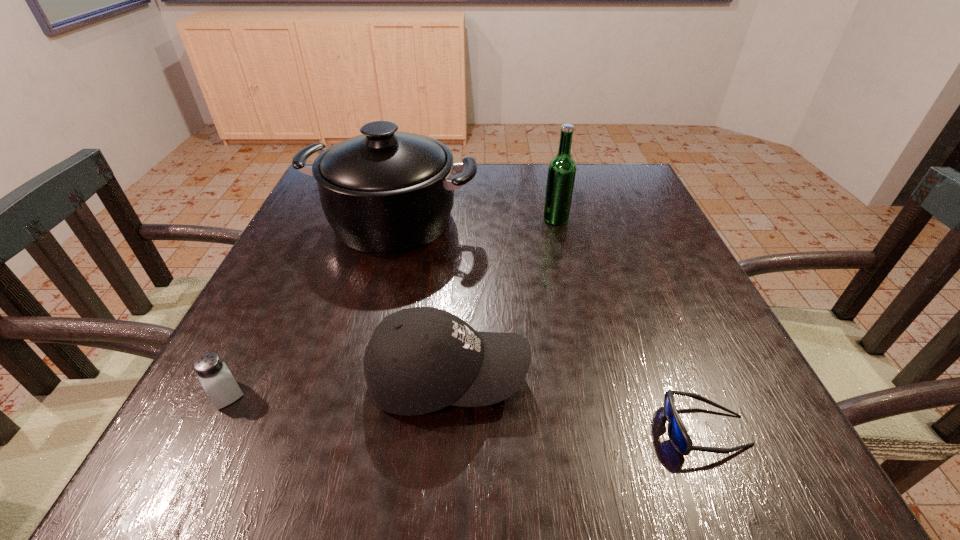
This screenshot has width=960, height=540. Find the location of `vacant space situated on the front-facing side of the sunglasses`. vacant space situated on the front-facing side of the sunglasses is located at coordinates (546, 430).

The image size is (960, 540). Find the location of `free point located on the front-facing side of the sunglasses`. free point located on the front-facing side of the sunglasses is located at coordinates (423, 430).

Where is `vacant position located on the front-facing side of the sunglasses`? vacant position located on the front-facing side of the sunglasses is located at coordinates (573, 430).

You are a GUI agent. You are given a task and a screenshot of the screen. Output one action in this format:
    pyautogui.click(x=<x>, y=<y>)
    Task: Click on the object located at the far edge
    This screenshot has width=960, height=540.
    Given the screenshot: What is the action you would take?
    pyautogui.click(x=384, y=192)

You are a GUI agent. You are given a task and a screenshot of the screen. Output one action in this format:
    pyautogui.click(x=<x>, y=<y>)
    Task: Click on the baseball cap that is at the near edge
    The image size is (960, 540).
    Given the screenshot: What is the action you would take?
    pyautogui.click(x=419, y=360)

Where is `sunglasses at the near edge`? sunglasses at the near edge is located at coordinates (677, 433).

You are a GUI agent. You are given a task and a screenshot of the screen. Output one action in this format:
    pyautogui.click(x=<x>, y=<y>)
    Task: Click on the saucepan situated at the left edge
    This screenshot has height=540, width=960.
    Given the screenshot: What is the action you would take?
    pyautogui.click(x=384, y=192)

Where is `saltshaker situated at the left edge`? saltshaker situated at the left edge is located at coordinates (213, 374).

You are a GUI agent. You are given a task and a screenshot of the screen. Output one action in this format:
    pyautogui.click(x=<x>, y=<y>)
    Task: Click on the object that is at the right edge
    
    Given the screenshot: What is the action you would take?
    pyautogui.click(x=677, y=433)

Identify the location of object located in the far left corner section of the desktop. (384, 192).